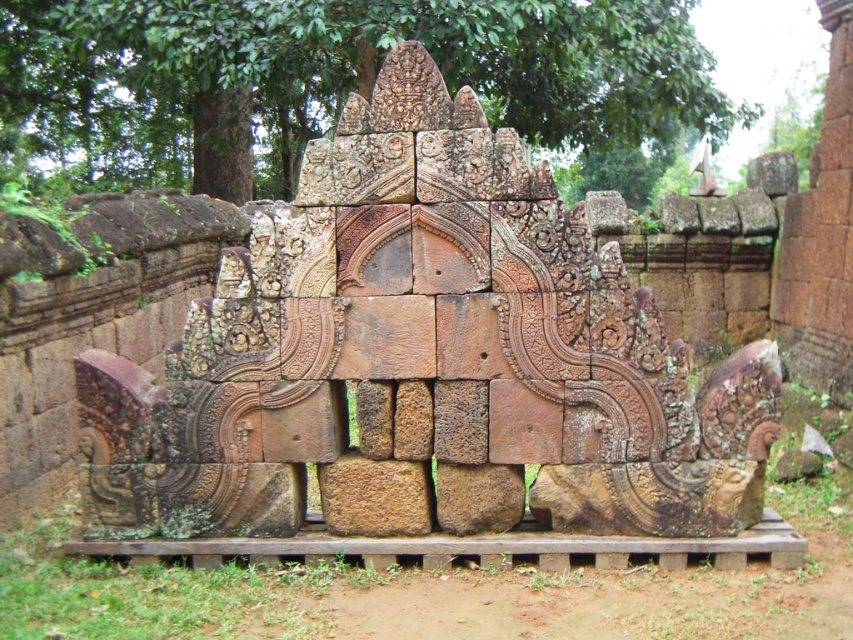
Question: Considering the relative positions of rustic stone sculpture at center and green leafy tree at upper center in the image provided, where is rustic stone sculpture at center located with respect to green leafy tree at upper center?

Choices:
 (A) right
 (B) left

Answer: (B)

Question: In this image, where is rustic stone sculpture at center located relative to green leafy tree at upper center?

Choices:
 (A) below
 (B) above

Answer: (A)

Question: Among these objects, which one is nearest to the camera?

Choices:
 (A) rustic stone sculpture at center
 (B) green leafy tree at upper center

Answer: (A)

Question: Which object appears farthest from the camera in this image?

Choices:
 (A) rustic stone sculpture at center
 (B) green leafy tree at upper center

Answer: (B)

Question: From the image, what is the correct spatial relationship of rustic stone sculpture at center in relation to green leafy tree at upper center?

Choices:
 (A) right
 (B) left

Answer: (B)